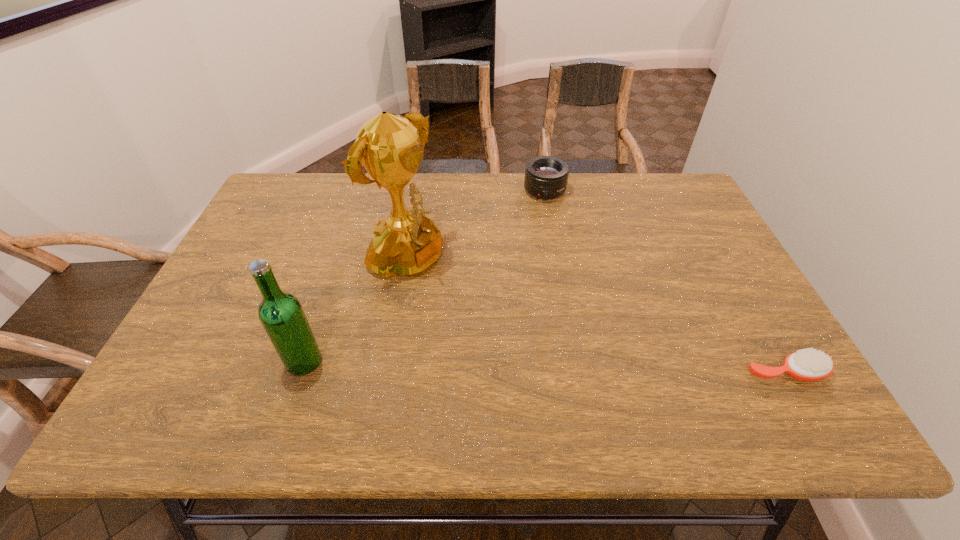
Find the location of `free space that satisfies the following two spatial constraints: 1. on the back side of the award; 2. on the left side of the farthest object`. free space that satisfies the following two spatial constraints: 1. on the back side of the award; 2. on the left side of the farthest object is located at coordinates (418, 191).

Find the location of a particular element. The height and width of the screenshot is (540, 960). free location that satisfies the following two spatial constraints: 1. on the back side of the tallest object; 2. on the left side of the leftmost object is located at coordinates (338, 261).